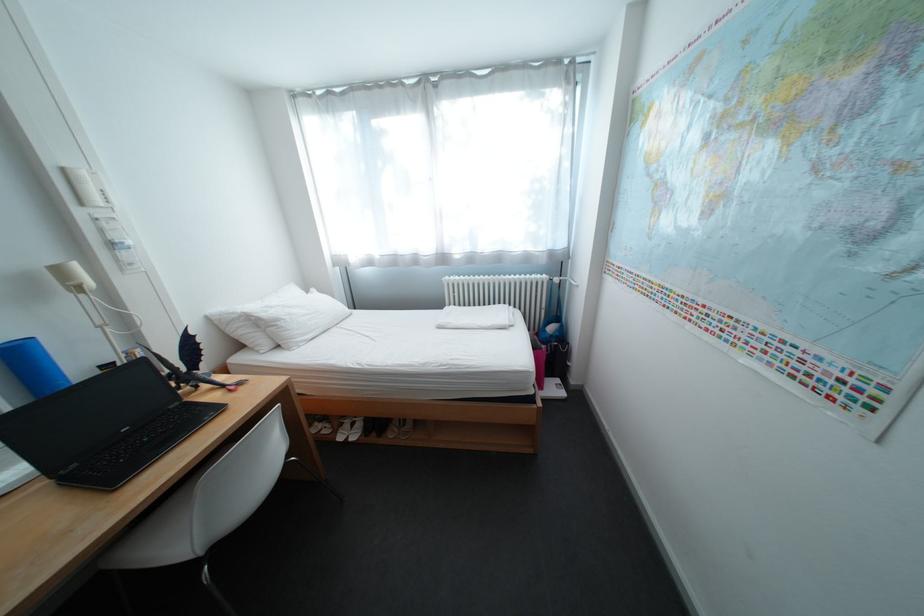
Find where to turn the radiator valve. Please return your answer as a coordinate pair (x, y).

(502, 293)